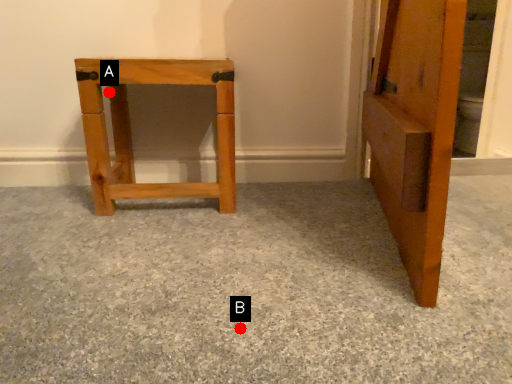
Question: Two points are circled on the image, labeled by A and B beside each circle. Which point is further to the camera?

Choices:
 (A) A is further
 (B) B is further

Answer: (A)